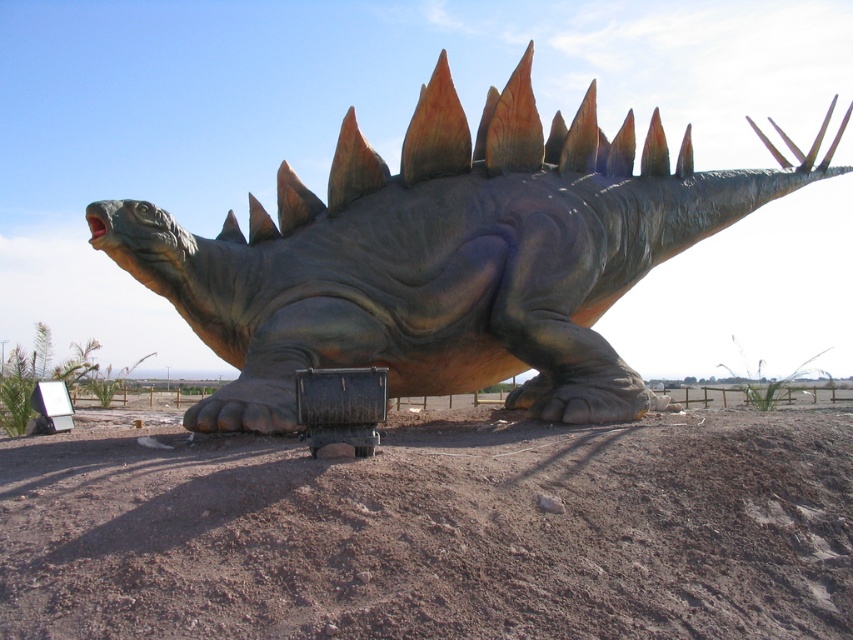
Is brown sandy dirt at center taller than shiny metallic dinosaur at center?

Incorrect, brown sandy dirt at center's height is not larger of shiny metallic dinosaur at center's.

Locate an element on the screen. The height and width of the screenshot is (640, 853). brown sandy dirt at center is located at coordinates (436, 531).

Which is in front, point (73, 444) or point (527, 221)?

Point (73, 444) is more forward.

Locate an element on the screen. brown sandy dirt at center is located at coordinates (436, 531).